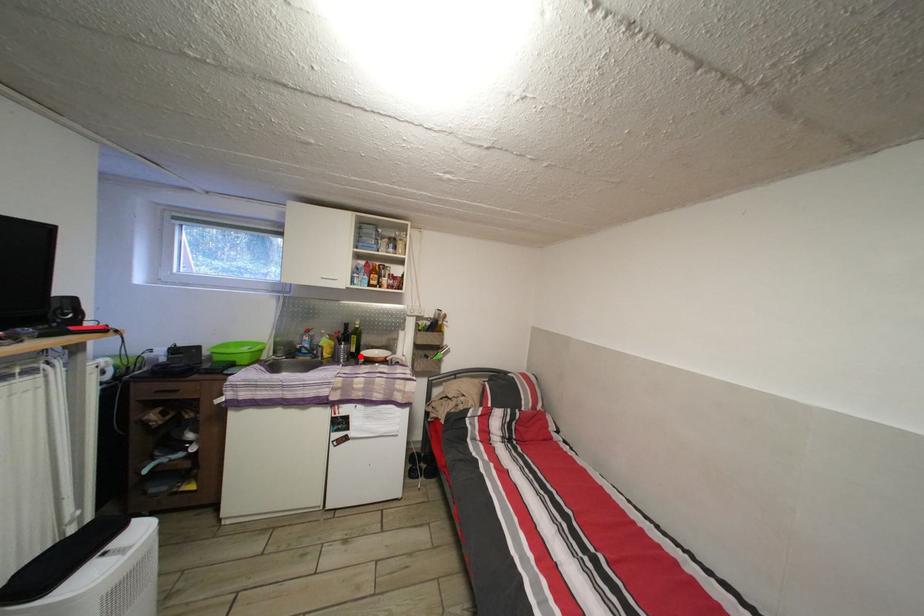
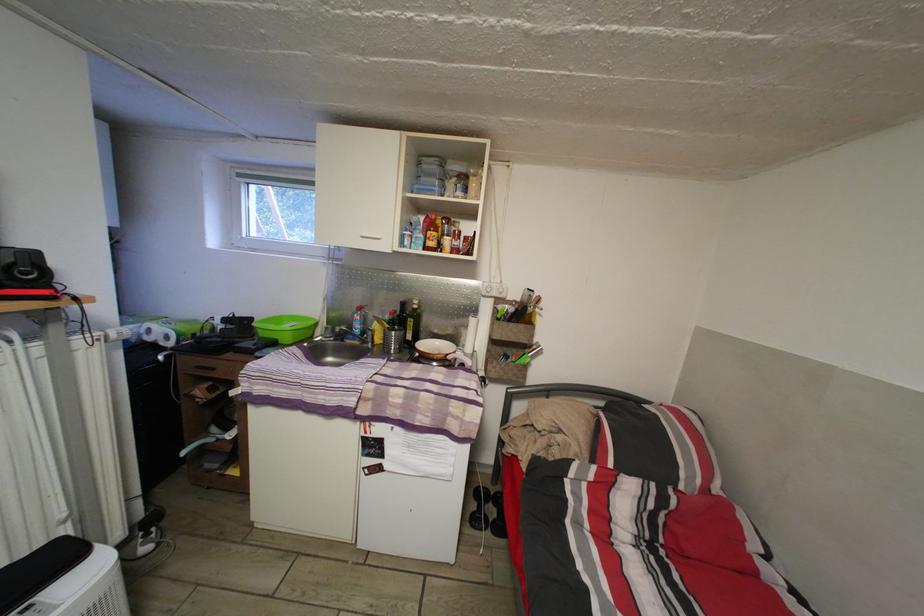
Where in the second image is the point corresponding to the highlighted location from the first image?

(417, 344)